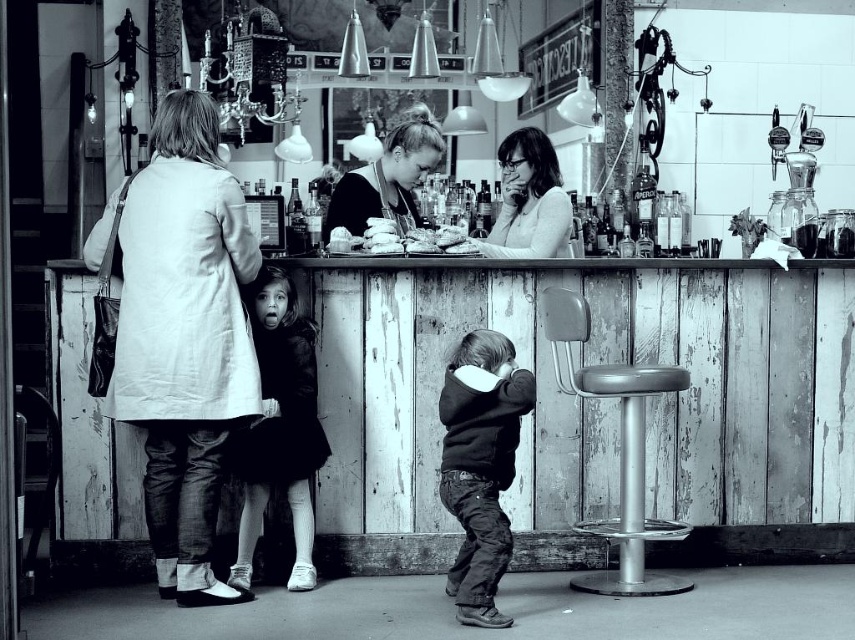
Who is taller, white fabric coat at left or smooth white bread at center?

white fabric coat at left is taller.

Can you confirm if white fabric coat at left is smaller than smooth white bread at center?

Actually, white fabric coat at left might be larger than smooth white bread at center.

Which is behind, point (124, 209) or point (385, 224)?

Point (385, 224)

You are a GUI agent. You are given a task and a screenshot of the screen. Output one action in this format:
    pyautogui.click(x=<x>, y=<y>)
    Task: Click on the white fabric coat at left
    The height and width of the screenshot is (640, 855).
    Given the screenshot: What is the action you would take?
    pyautogui.click(x=186, y=339)

Who is positioned more to the left, white fabric coat at left or matte white blouse at upper center?

white fabric coat at left is more to the left.

Can you confirm if white fabric coat at left is positioned to the right of matte white blouse at upper center?

No, white fabric coat at left is not to the right of matte white blouse at upper center.

The image size is (855, 640). What do you see at coordinates (186, 339) in the screenshot? I see `white fabric coat at left` at bounding box center [186, 339].

The image size is (855, 640). I want to click on white fabric coat at left, so click(x=186, y=339).

Can you confirm if white fabric coat at left is positioned below dark fur coat at center?

Incorrect, white fabric coat at left is not positioned below dark fur coat at center.

Can you confirm if white fabric coat at left is wider than dark fur coat at center?

Indeed, white fabric coat at left has a greater width compared to dark fur coat at center.

Is point (199, 508) closer to camera compared to point (299, 561)?

Yes, it is in front of point (299, 561).

Image resolution: width=855 pixels, height=640 pixels. What are the coordinates of `white fabric coat at left` in the screenshot? It's located at (186, 339).